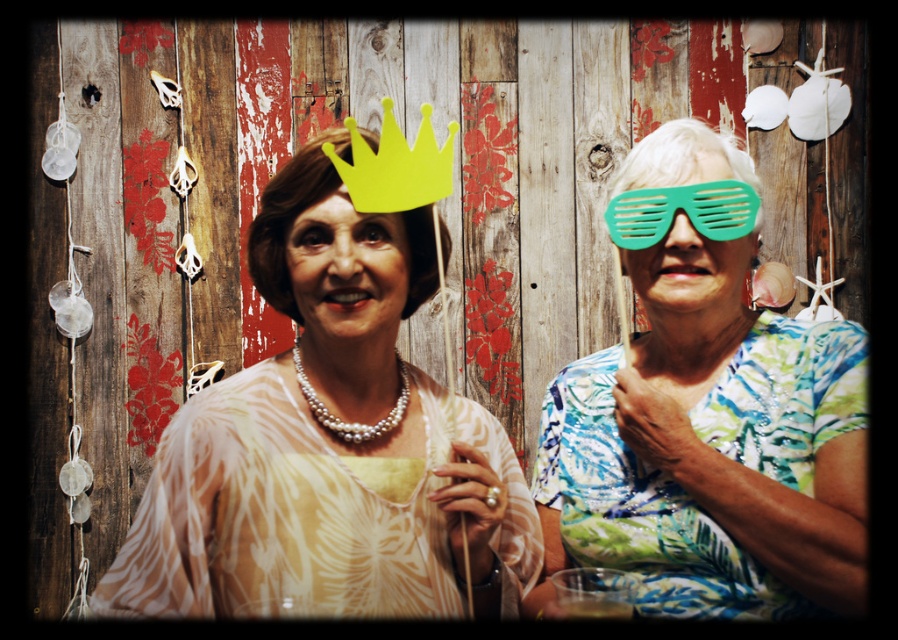
Question: Can you confirm if white sheer dress at center is positioned to the left of yellow paper crown at center?

Choices:
 (A) yes
 (B) no

Answer: (B)

Question: Where is green plastic glasses at right located in relation to white sheer dress at center in the image?

Choices:
 (A) left
 (B) right

Answer: (B)

Question: Based on their relative distances, which object is farther from the green plastic glasses at center?

Choices:
 (A) green plastic glasses at right
 (B) green plastic goggles at right

Answer: (A)

Question: Which object is closer to the camera taking this photo?

Choices:
 (A) matte yellow crown at upper center
 (B) yellow paper crown at center
 (C) white sheer dress at center

Answer: (C)

Question: Which object is farther from the camera taking this photo?

Choices:
 (A) white sheer dress at center
 (B) yellow paper crown at center

Answer: (B)

Question: Does matte yellow crown at upper center appear on the right side of green plastic glasses at center?

Choices:
 (A) yes
 (B) no

Answer: (B)